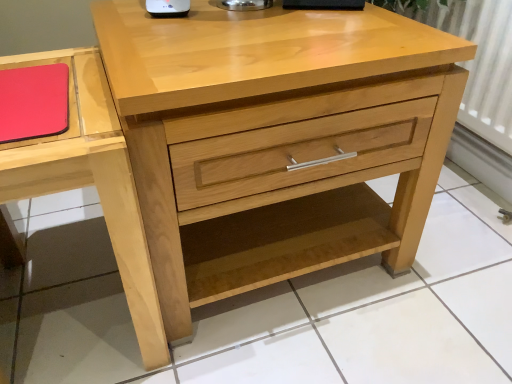
Describe the element at coordinates (34, 102) in the screenshot. The image size is (512, 384). I see `rubberized matte red notepad at upper left` at that location.

Identify the location of matte wood vanity at left. (91, 181).

From the image's perspective, is rubberized matte red notepad at upper left located above natural wood chest of drawers at center?

Yes.

In terms of width, does rubberized matte red notepad at upper left look wider or thinner when compared to natural wood chest of drawers at center?

rubberized matte red notepad at upper left is thinner than natural wood chest of drawers at center.

How distant is rubberized matte red notepad at upper left from natural wood chest of drawers at center?

rubberized matte red notepad at upper left is 15.06 inches away from natural wood chest of drawers at center.

Does rubberized matte red notepad at upper left have a greater height compared to natural wood chest of drawers at center?

No.

Is matte wood vanity at left in front of or behind natural wood chest of drawers at center in the image?

Clearly, matte wood vanity at left is in front of natural wood chest of drawers at center.

Which object is positioned more to the right, matte wood vanity at left or natural wood chest of drawers at center?

natural wood chest of drawers at center is more to the right.

Are matte wood vanity at left and natural wood chest of drawers at center beside each other?

matte wood vanity at left and natural wood chest of drawers at center are not in contact.

How distant is matte wood vanity at left from natural wood chest of drawers at center?

matte wood vanity at left and natural wood chest of drawers at center are 9.74 inches apart from each other.

Considering the relative sizes of natural wood chest of drawers at center and rubberized matte red notepad at upper left in the image provided, is natural wood chest of drawers at center smaller than rubberized matte red notepad at upper left?

No, natural wood chest of drawers at center is not smaller than rubberized matte red notepad at upper left.

Between natural wood chest of drawers at center and rubberized matte red notepad at upper left, which one appears on the right side from the viewer's perspective?

From the viewer's perspective, natural wood chest of drawers at center appears more on the right side.

Based on the photo, is natural wood chest of drawers at center oriented towards rubberized matte red notepad at upper left?

No, natural wood chest of drawers at center is not aimed at rubberized matte red notepad at upper left.

Is point (412, 248) closer or farther from the camera than point (55, 86)?

Point (412, 248) is farther from the camera than point (55, 86).

Considering the positions of objects natural wood chest of drawers at center and matte wood vanity at left in the image provided, who is behind, natural wood chest of drawers at center or matte wood vanity at left?

natural wood chest of drawers at center is behind.

How far apart are natural wood chest of drawers at center and matte wood vanity at left?

natural wood chest of drawers at center is 9.74 inches away from matte wood vanity at left.

Can you confirm if natural wood chest of drawers at center is thinner than matte wood vanity at left?

In fact, natural wood chest of drawers at center might be wider than matte wood vanity at left.

From a real-world perspective, is natural wood chest of drawers at center located beneath matte wood vanity at left?

Actually, natural wood chest of drawers at center is physically above matte wood vanity at left in the real world.

Could you tell me if matte wood vanity at left is facing rubberized matte red notepad at upper left?

No, matte wood vanity at left is not oriented towards rubberized matte red notepad at upper left.

From a real-world perspective, is matte wood vanity at left positioned above or below rubberized matte red notepad at upper left?

From a real-world perspective, matte wood vanity at left is physically below rubberized matte red notepad at upper left.

Image resolution: width=512 pixels, height=384 pixels. I want to click on notepad above the matte wood vanity at left (from the image's perspective), so click(x=34, y=102).

Who is more distant, matte wood vanity at left or rubberized matte red notepad at upper left?

rubberized matte red notepad at upper left is behind.

How different are the orientations of rubberized matte red notepad at upper left and matte wood vanity at left in degrees?

0.958 degrees separate the facing orientations of rubberized matte red notepad at upper left and matte wood vanity at left.

Is matte wood vanity at left at the back of rubberized matte red notepad at upper left?

Yes, rubberized matte red notepad at upper left's orientation is away from matte wood vanity at left.

Between rubberized matte red notepad at upper left and matte wood vanity at left, which one has more height?

matte wood vanity at left.

From the image's perspective, is rubberized matte red notepad at upper left over matte wood vanity at left?

Correct, rubberized matte red notepad at upper left appears higher than matte wood vanity at left in the image.

This screenshot has width=512, height=384. I want to click on notepad that appears on the left of natural wood chest of drawers at center, so click(34, 102).

This screenshot has height=384, width=512. I want to click on chest of drawers to the right of matte wood vanity at left, so click(276, 140).

From the image, which object appears to be farther from natural wood chest of drawers at center, rubberized matte red notepad at upper left or matte wood vanity at left?

The object further to natural wood chest of drawers at center is rubberized matte red notepad at upper left.

From the image, which object appears to be farther from matte wood vanity at left, rubberized matte red notepad at upper left or natural wood chest of drawers at center?

natural wood chest of drawers at center is further to matte wood vanity at left.

Looking at the image, which one is located further to rubberized matte red notepad at upper left, matte wood vanity at left or natural wood chest of drawers at center?

natural wood chest of drawers at center.

Looking at the image, which one is located closer to natural wood chest of drawers at center, matte wood vanity at left or rubberized matte red notepad at upper left?

matte wood vanity at left.

Looking at the image, which one is located closer to rubberized matte red notepad at upper left, natural wood chest of drawers at center or matte wood vanity at left?

matte wood vanity at left is positioned closer to the anchor rubberized matte red notepad at upper left.

Based on their spatial positions, is natural wood chest of drawers at center or rubberized matte red notepad at upper left further from matte wood vanity at left?

natural wood chest of drawers at center.

This screenshot has height=384, width=512. What are the coordinates of `notepad between matte wood vanity at left and natural wood chest of drawers at center from left to right` in the screenshot? It's located at (34, 102).